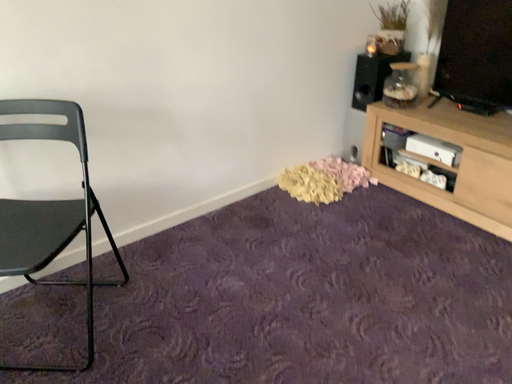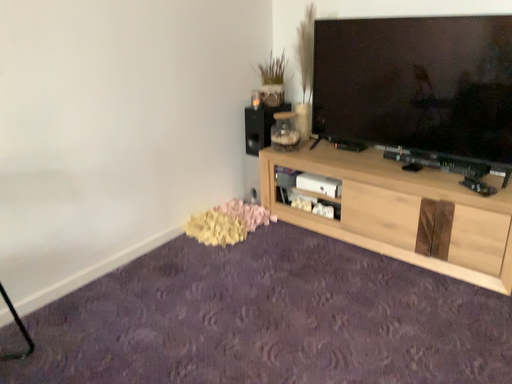
Question: Which way did the camera rotate in the video?

Choices:
 (A) rotated downward
 (B) rotated upward

Answer: (B)